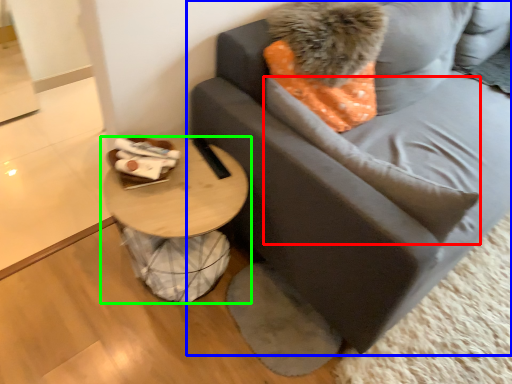
Question: Considering the real-world distances, which object is closest to pillow (highlighted by a red box)? studio couch (highlighted by a blue box) or table (highlighted by a green box).

Choices:
 (A) studio couch
 (B) table

Answer: (A)